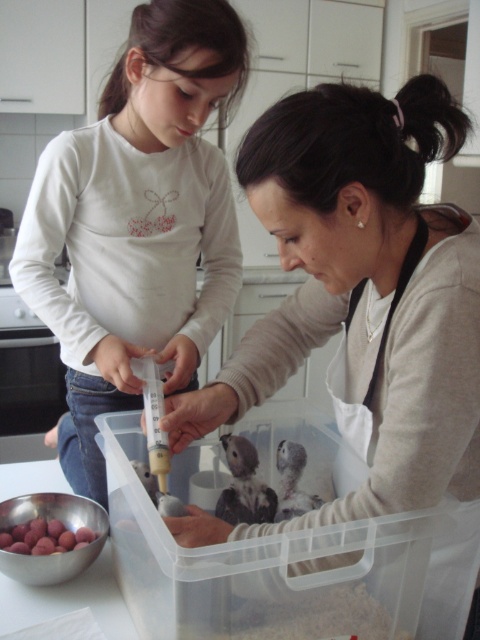
Can you confirm if fluffy gray bird at center is smaller than smooth metallic bowl at lower left?

Incorrect, fluffy gray bird at center is not smaller in size than smooth metallic bowl at lower left.

Is point (263, 515) positioned in front of point (44, 547)?

No.

This screenshot has height=640, width=480. I want to click on fluffy gray bird at center, so click(x=243, y=484).

Does matte white apron at center have a smaller size compared to matte white shirt at upper left?

Indeed, matte white apron at center has a smaller size compared to matte white shirt at upper left.

Does point (215, 419) come closer to viewer compared to point (137, 64)?

Yes, point (215, 419) is closer to viewer.

Between point (280, 259) and point (130, 387), which one is positioned in front?

Point (280, 259) is in front.

Locate an element on the screen. matte white apron at center is located at coordinates 363,288.

Does matte white shirt at upper left appear over smooth metallic bowl at lower left?

Yes, matte white shirt at upper left is above smooth metallic bowl at lower left.

The width and height of the screenshot is (480, 640). What do you see at coordinates (137, 221) in the screenshot?
I see `matte white shirt at upper left` at bounding box center [137, 221].

Which is behind, point (165, 336) or point (49, 532)?

Positioned behind is point (165, 336).

The image size is (480, 640). What are the coordinates of `matte white shirt at upper left` in the screenshot? It's located at (137, 221).